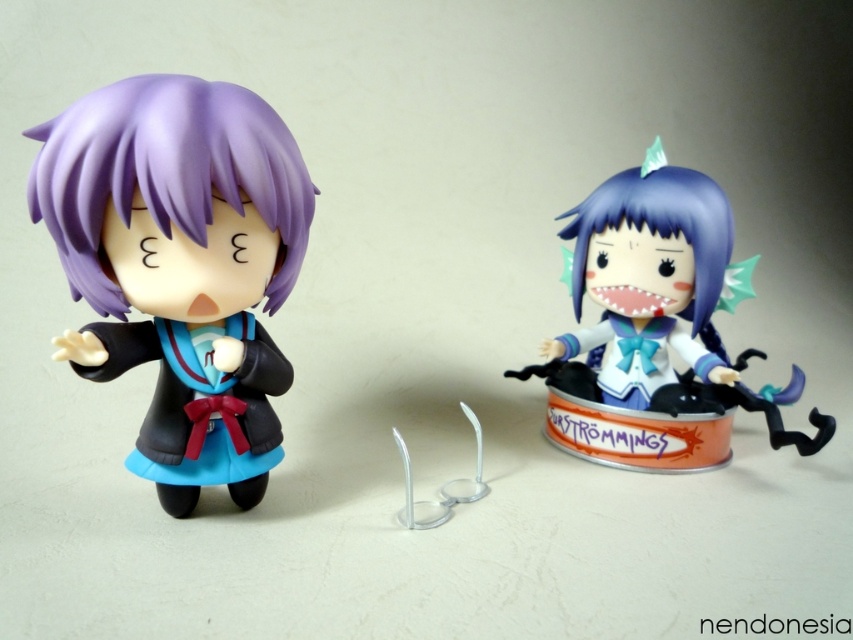
You are organizing a display for a toy store and need to place the matte black doll at left and the satin blue figurine at center on a shelf. The shelf has a width of 10 cm. If the combined width of both figurines is 12 cm, will they fit side by side on the shelf?

The combined width of the matte black doll at left and the satin blue figurine at center is 12 cm, which exceeds the shelf width of 10 cm. Therefore, they cannot fit side by side on the shelf.

You are a collector examining two figurines on a desk. You have the matte black doll at left and the satin blue figurine at center. Which one do you need to move first to reach the one farther away?

You need to move the matte black doll at left first because it is closer to you than the satin blue figurine at center, which is farther away.